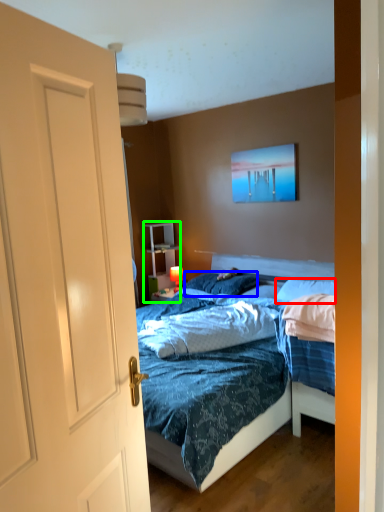
Question: Based on their relative distances, which object is farther from pillow (highlighted by a red box)? Choose from pillow (highlighted by a blue box) and armoire (highlighted by a green box).

Choices:
 (A) pillow
 (B) armoire

Answer: (B)